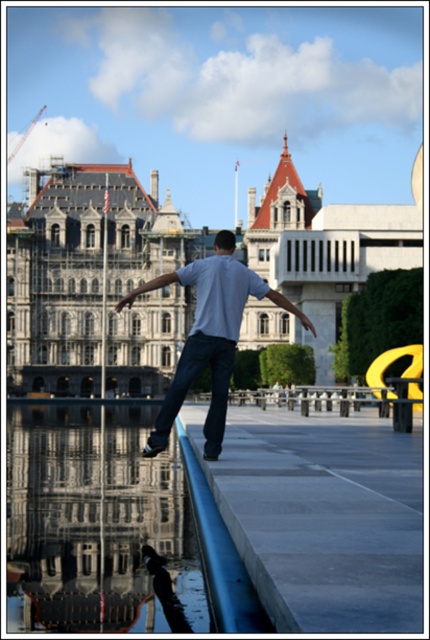
Question: Which point is closer to the camera?

Choices:
 (A) denim jeans at center
 (B) clear glass water at lower left

Answer: (B)

Question: Does clear glass water at lower left appear under denim jeans at center?

Choices:
 (A) no
 (B) yes

Answer: (B)

Question: Can you confirm if clear glass water at lower left is bigger than denim jeans at center?

Choices:
 (A) no
 (B) yes

Answer: (B)

Question: Is the position of clear glass water at lower left more distant than that of denim jeans at center?

Choices:
 (A) no
 (B) yes

Answer: (A)

Question: Among these objects, which one is nearest to the camera?

Choices:
 (A) denim jeans at center
 (B) clear glass water at lower left

Answer: (B)